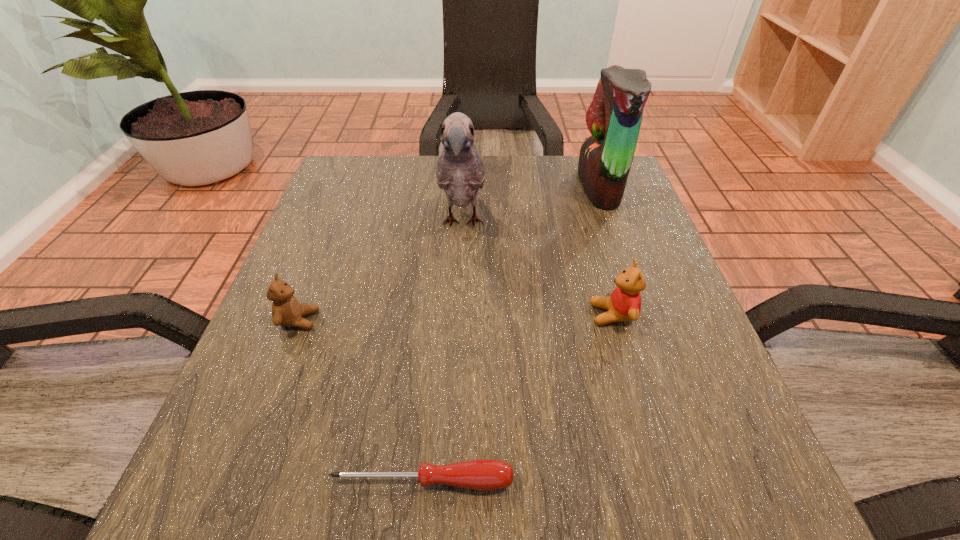
Find the location of `object positioned at the far right corner`. object positioned at the far right corner is located at coordinates (614, 117).

The image size is (960, 540). Identify the location of free spot at the far edge of the desktop. (541, 155).

You are a GUI agent. You are given a task and a screenshot of the screen. Output one action in this format:
    pyautogui.click(x=<x>, y=<y>)
    Task: Click on the vacant region at the near edge of the desktop
    
    Given the screenshot: What is the action you would take?
    pyautogui.click(x=468, y=492)

Locate an element on the screen. The image size is (960, 540). vacant space at the left edge of the desktop is located at coordinates (352, 239).

The width and height of the screenshot is (960, 540). What are the coordinates of `free space at the right edge of the desktop` in the screenshot? It's located at (601, 231).

I want to click on blank area at the near right corner, so click(x=744, y=508).

The width and height of the screenshot is (960, 540). What are the coordinates of `free space that is in between the right parrot and the fourth tallest object` in the screenshot? It's located at (449, 254).

This screenshot has width=960, height=540. What are the coordinates of `free space between the left teddy bear and the screwdriver` in the screenshot? It's located at (361, 400).

Find the location of a particular element. This screenshot has height=540, width=960. vacant point located between the second shortest object and the right teddy bear is located at coordinates (456, 318).

This screenshot has height=540, width=960. In order to click on vacant space that is in between the right parrot and the left teddy bear in this screenshot , I will do `click(449, 254)`.